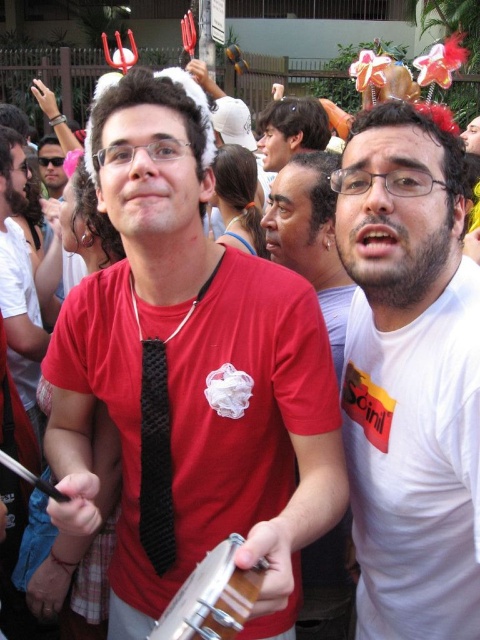
Where is the white matte shirt at center located in the image?

The white matte shirt at center is located at point (409, 378) in the image.

You are a photographer at the festival and want to capture a photo of the white matte shirt at center and the wooden drum at center. Based on their heights, which object should be placed closer to the camera to ensure both are fully visible in the frame?

The white matte shirt at center is taller than the wooden drum at center, so to ensure both are fully visible in the frame, the wooden drum at center should be placed closer to the camera.

You are a photographer at the festival and want to capture the smooth white shirt at center and the black textured tie at center in a single shot. Which object should you focus on first to ensure both are in frame?

The smooth white shirt at center is positioned over the black textured tie at center, so you should focus on the smooth white shirt at center first to ensure both are in frame.